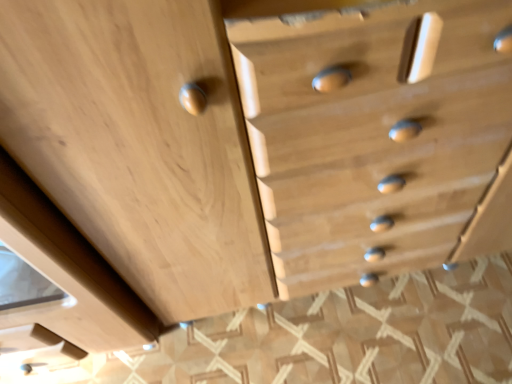
Question: Should I look upward or downward to see natural wood drawer at center?

Choices:
 (A) up
 (B) down

Answer: (A)